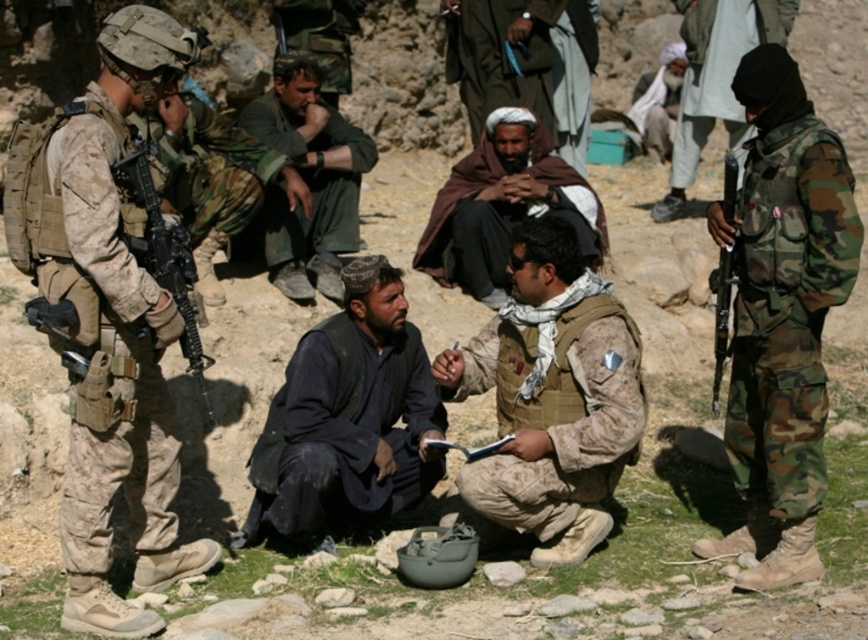
Locate an element on the screen. This screenshot has height=640, width=868. dark blue fabric at center is located at coordinates (347, 419).

Which is in front, point (385, 362) or point (730, 8)?

Point (385, 362) is in front.

Find the location of a particular element. This screenshot has width=868, height=640. dark blue fabric at center is located at coordinates (347, 419).

Who is higher up, camouflage fabric uniform at right or matte black rifle at left?

A: matte black rifle at left is above.

Does camouflage fabric uniform at right have a smaller size compared to matte black rifle at left?

No, camouflage fabric uniform at right is not smaller than matte black rifle at left.

Locate an element on the screen. This screenshot has width=868, height=640. camouflage fabric uniform at right is located at coordinates (786, 308).

Is point (115, 92) farther from viewer compared to point (324, 212)?

No, it is in front of (324, 212).

Which is in front, point (61, 200) or point (278, 218)?

Point (61, 200)

Is point (110, 532) closer to viewer compared to point (327, 230)?

Yes, point (110, 532) is in front of point (327, 230).

Locate an element on the screen. The width and height of the screenshot is (868, 640). camouflage fabric uniform at left is located at coordinates (117, 483).